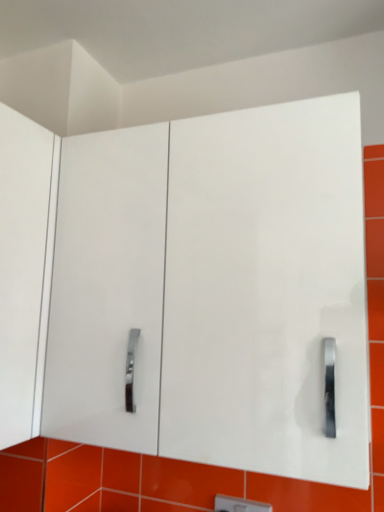
Question: Considering the positions of point (228, 505) and point (269, 424), is point (228, 505) closer or farther from the camera than point (269, 424)?

Choices:
 (A) closer
 (B) farther

Answer: (B)

Question: From the image's perspective, is white plastic light switch at center located above or below white glossy cabinet at center?

Choices:
 (A) below
 (B) above

Answer: (A)

Question: In terms of size, does white plastic light switch at center appear bigger or smaller than white glossy cabinet at center?

Choices:
 (A) small
 (B) big

Answer: (A)

Question: Is white glossy cabinet at center inside or outside of white plastic light switch at center?

Choices:
 (A) inside
 (B) outside

Answer: (B)

Question: Considering their positions, is white glossy cabinet at center located in front of or behind white plastic light switch at center?

Choices:
 (A) front
 (B) behind

Answer: (A)

Question: From the image's perspective, is white glossy cabinet at center above or below white plastic light switch at center?

Choices:
 (A) above
 (B) below

Answer: (A)

Question: Based on their sizes in the image, would you say white glossy cabinet at center is bigger or smaller than white plastic light switch at center?

Choices:
 (A) big
 (B) small

Answer: (A)